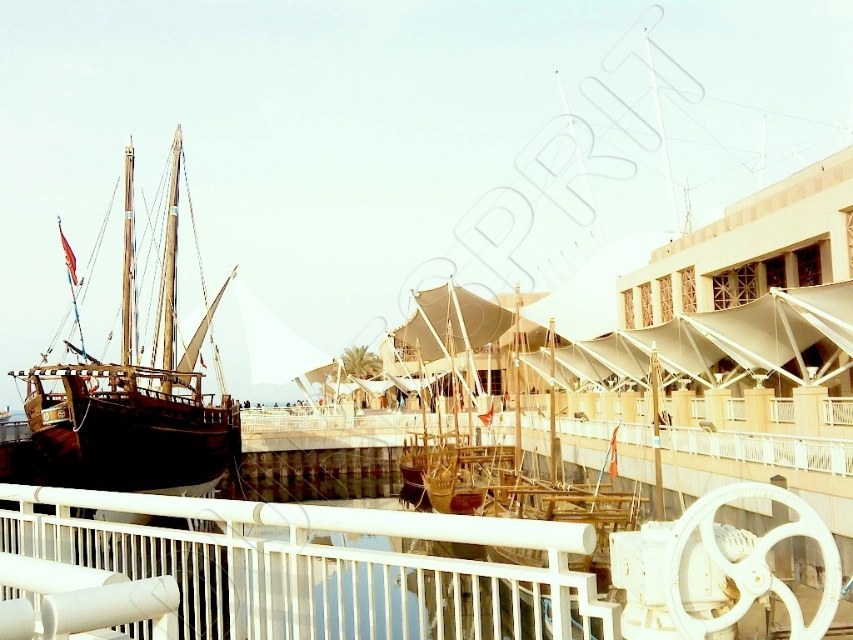
Consider the image. You are standing on the pier and want to take a photo of the wooden sailboat at center without any obstructions. The white metal fence at lower center might block your view. Based on their heights, can you position yourself so that the fence doesn

The white metal fence at lower center is shorter than the wooden sailboat at center. Therefore, if you position yourself so that the fence is between you and the boat, as long as you are far enough back, the top of the boat will still be visible above the fence.

You are standing on the pier and see the white metal fence at lower center and the wooden sailboat at center. Which object is positioned to the left when facing the scene?

The white metal fence at lower center is to the left of the wooden sailboat at center, so the white metal fence at lower center is positioned to the left when facing the scene.